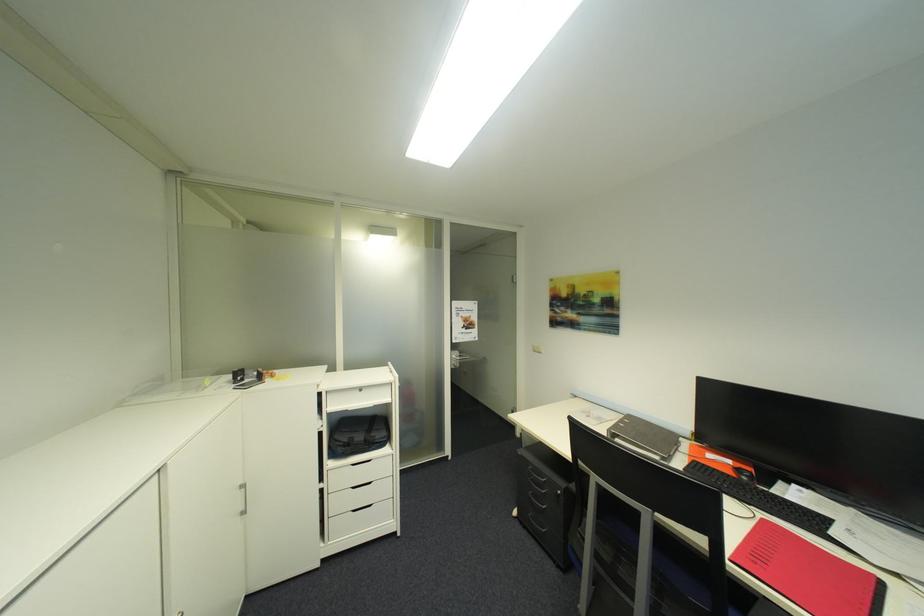
The location [720,461] corresponds to which object?

It corresponds to the orange computer mouse in the image.